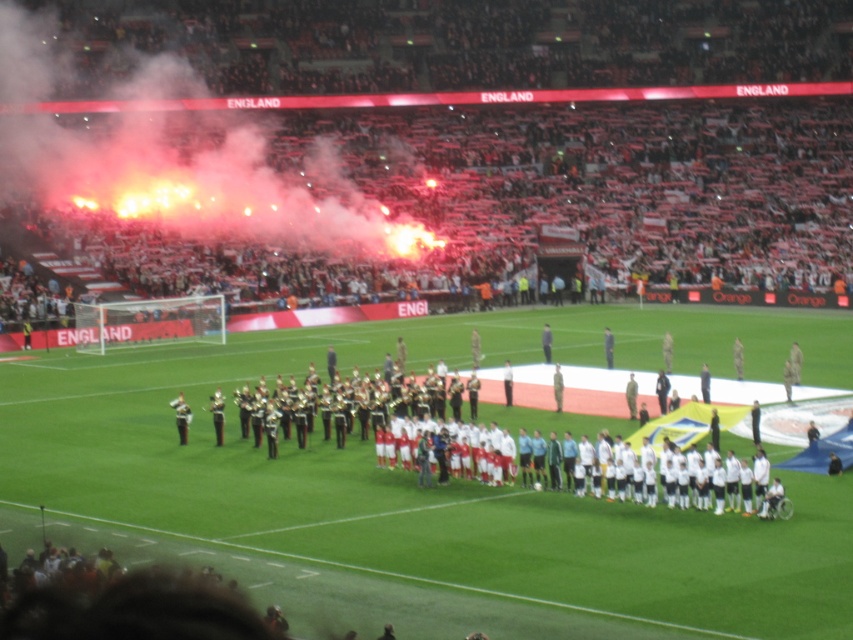
Does red smoke at upper left appear over white fabric football team at center?

Yes, red smoke at upper left is above white fabric football team at center.

Where is `red smoke at upper left`? The width and height of the screenshot is (853, 640). red smoke at upper left is located at coordinates (177, 164).

The height and width of the screenshot is (640, 853). What are the coordinates of `red smoke at upper left` in the screenshot? It's located at (177, 164).